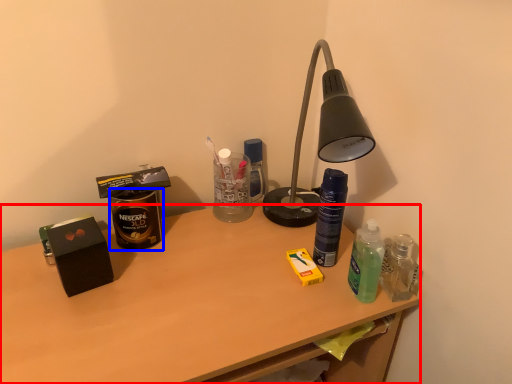
Question: Which of the following is the farthest to the observer, desk (highlighted by a red box) or beverage (highlighted by a blue box)?

Choices:
 (A) desk
 (B) beverage

Answer: (B)